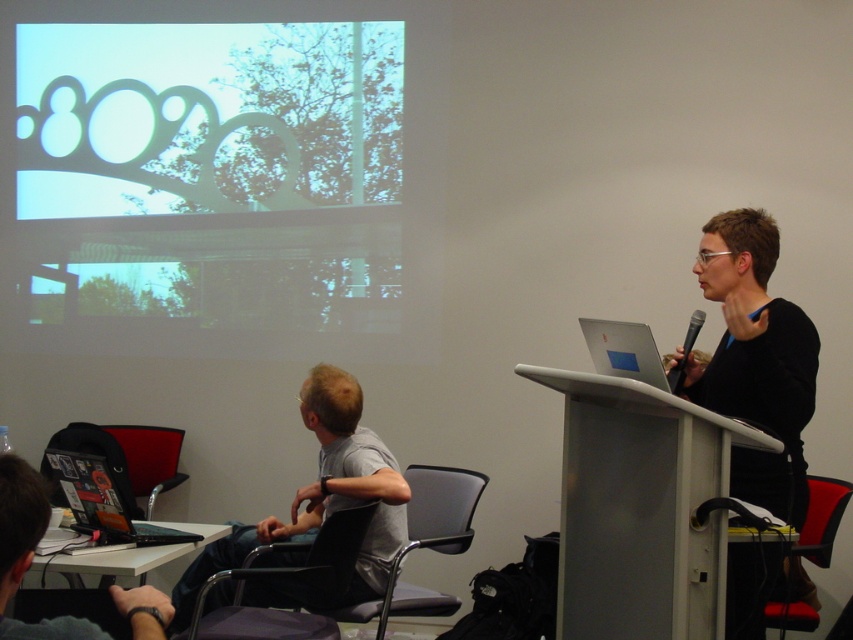
How far apart are gray fabric shirt at lower left and black fabric chair at lower left?

gray fabric shirt at lower left is 1.18 meters away from black fabric chair at lower left.

Which is above, gray fabric shirt at lower left or black fabric chair at lower left?

gray fabric shirt at lower left is higher up.

What are the coordinates of `gray fabric shirt at lower left` in the screenshot? It's located at (318, 506).

Is black fabric chair at lower left to the right of red fabric chair at lower right from the viewer's perspective?

In fact, black fabric chair at lower left is to the left of red fabric chair at lower right.

Is black fabric chair at lower left wider than red fabric chair at lower right?

In fact, black fabric chair at lower left might be narrower than red fabric chair at lower right.

Who is more forward, (x=138, y=493) or (x=842, y=500)?

Positioned in front is point (x=842, y=500).

I want to click on black fabric chair at lower left, so click(129, 458).

Is black fabric chair at lower center to the left of black plastic microphone at upper right from the viewer's perspective?

Correct, you'll find black fabric chair at lower center to the left of black plastic microphone at upper right.

Who is positioned more to the right, black fabric chair at lower center or black plastic microphone at upper right?

black plastic microphone at upper right

Locate an element on the screen. The image size is (853, 640). black fabric chair at lower center is located at coordinates (289, 576).